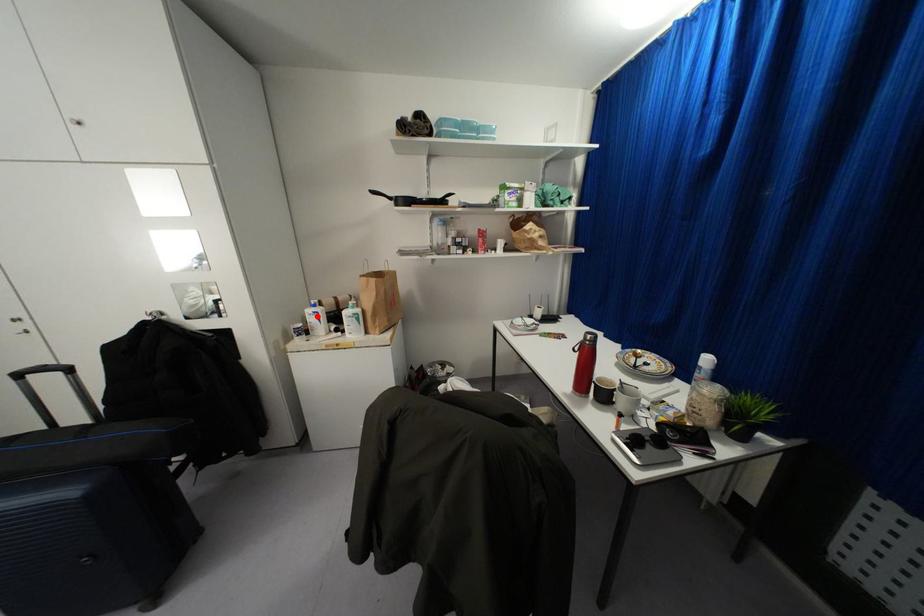
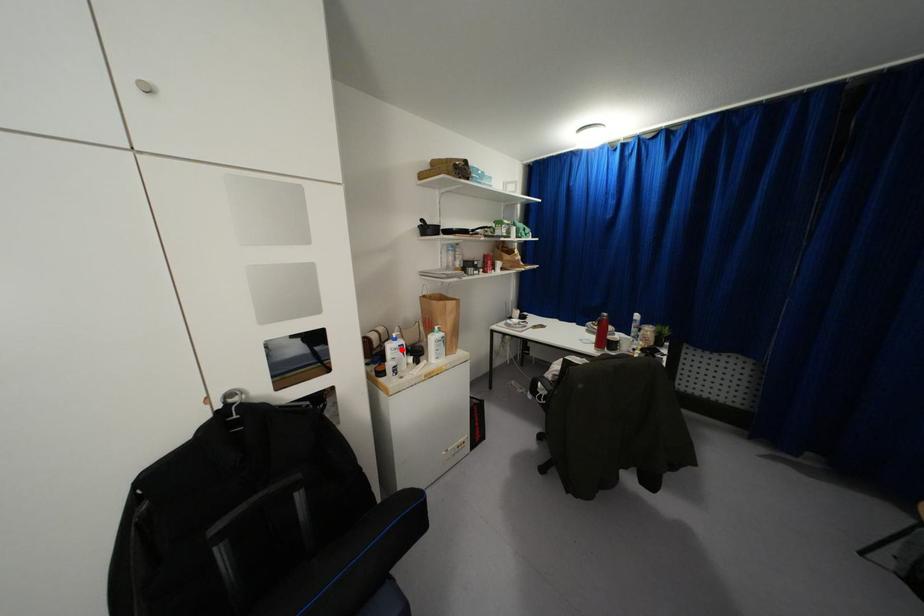
I am providing you with two images of the same scene from different viewpoints. A red point is marked on the first image and another point is marked on the second image. Is the red point in image1 aligned with the point shown in image2?

Yes